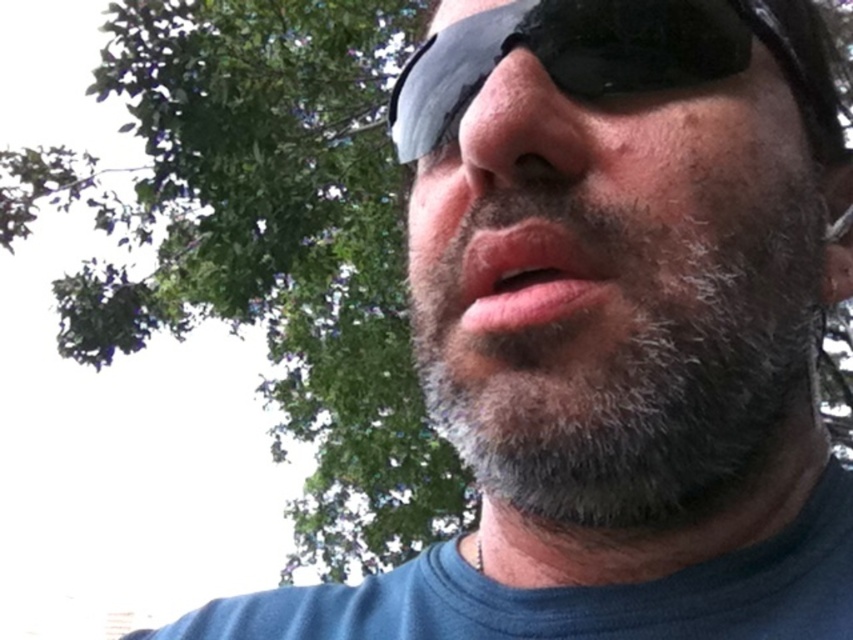
Question: Which point appears closest to the camera in this image?

Choices:
 (A) (x=583, y=3)
 (B) (x=531, y=243)
 (C) (x=733, y=365)
 (D) (x=509, y=161)

Answer: (D)

Question: Can you confirm if black matte sunglasses at center is thinner than pink matte lips at center?

Choices:
 (A) no
 (B) yes

Answer: (A)

Question: Among these points, which one is farthest from the camera?

Choices:
 (A) (804, 369)
 (B) (401, 138)
 (C) (474, 195)

Answer: (B)

Question: Does black matte sunglasses at center have a greater width compared to dry matte nose at center?

Choices:
 (A) yes
 (B) no

Answer: (A)

Question: Is dry matte nose at center smaller than pink matte lips at center?

Choices:
 (A) no
 (B) yes

Answer: (A)

Question: Estimate the real-world distances between objects in this image. Which object is closer to the black matte sunglasses at center?

Choices:
 (A) pink matte lips at center
 (B) gray fuzzy beard at center
 (C) dry matte nose at center

Answer: (C)